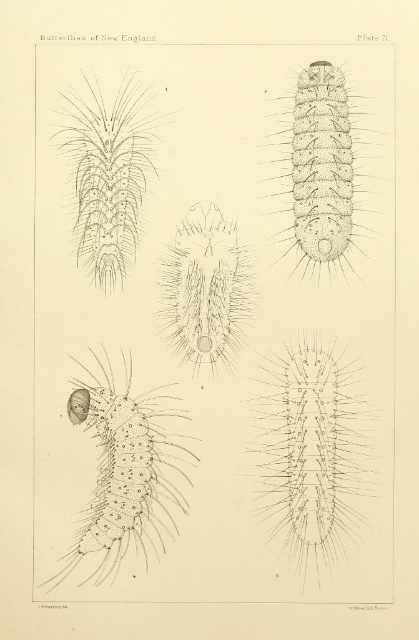
In the illustration from the scientific publication, you see a spiky brown caterpillar at upper right and a gray spiky caterpillar at upper left. Which caterpillar is positioned to the right of the other?

The spiky brown caterpillar at upper right is to the right of the gray spiky caterpillar at upper left.

You are examining the scientific illustration of caterpillars. There are two points marked in the image at coordinates point (x=343, y=244) and point (x=129, y=152). Which point is closer to you?

Point (x=129, y=152) is closer to you because it is less further to the camera than point (x=343, y=244).